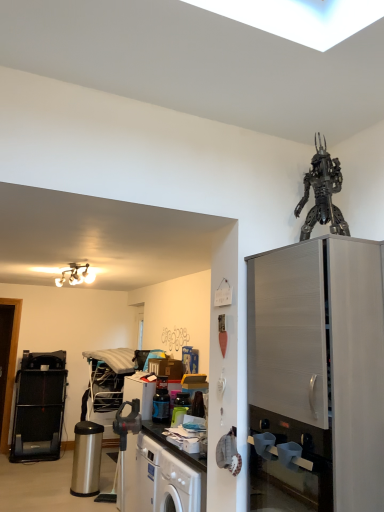
Question: Is metallic blue blender at center, the 3th appliance viewed from the back, shorter than satin silver cabinet at right?

Choices:
 (A) no
 (B) yes

Answer: (B)

Question: Does metallic blue blender at center, the 3th appliance viewed from the back, appear on the left side of satin silver cabinet at right?

Choices:
 (A) yes
 (B) no

Answer: (A)

Question: Is metallic blue blender at center, the 3th appliance viewed from the back, not inside satin silver cabinet at right?

Choices:
 (A) no
 (B) yes

Answer: (B)

Question: Does metallic blue blender at center, the 1th appliance when ordered from right to left, have a smaller size compared to satin silver cabinet at right?

Choices:
 (A) no
 (B) yes

Answer: (B)

Question: Is metallic blue blender at center, the 1th appliance when ordered from right to left, beside satin silver cabinet at right?

Choices:
 (A) no
 (B) yes

Answer: (A)

Question: Is metallic blue blender at center, the 3th appliance viewed from the back, positioned with its back to satin silver cabinet at right?

Choices:
 (A) no
 (B) yes

Answer: (A)

Question: Is the depth of black plastic treadmill at left, arranged as the first appliance when viewed from the back, greater than that of metallic robot at upper right?

Choices:
 (A) yes
 (B) no

Answer: (A)

Question: From the image's perspective, does black plastic treadmill at left, the third appliance viewed from the front, appear higher than metallic robot at upper right?

Choices:
 (A) yes
 (B) no

Answer: (B)

Question: Is black plastic treadmill at left, the third appliance viewed from the front, outside of metallic robot at upper right?

Choices:
 (A) yes
 (B) no

Answer: (A)

Question: From a real-world perspective, is black plastic treadmill at left, the third appliance viewed from the front, beneath metallic robot at upper right?

Choices:
 (A) yes
 (B) no

Answer: (A)

Question: Considering the relative sizes of black plastic treadmill at left, the third appliance viewed from the front, and metallic robot at upper right in the image provided, is black plastic treadmill at left, the third appliance viewed from the front, wider than metallic robot at upper right?

Choices:
 (A) no
 (B) yes

Answer: (B)

Question: Is black plastic treadmill at left, which ranks as the third appliance in right-to-left order, shorter than metallic robot at upper right?

Choices:
 (A) yes
 (B) no

Answer: (B)

Question: From a real-world perspective, is metallic robot at upper right positioned over black plastic treadmill at left, the third appliance viewed from the front, based on gravity?

Choices:
 (A) no
 (B) yes

Answer: (B)